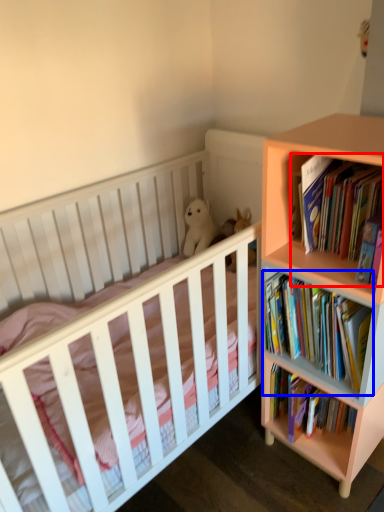
Question: Which point is closer to the camera, book (highlighted by a red box) or book (highlighted by a blue box)?

Choices:
 (A) book
 (B) book

Answer: (A)